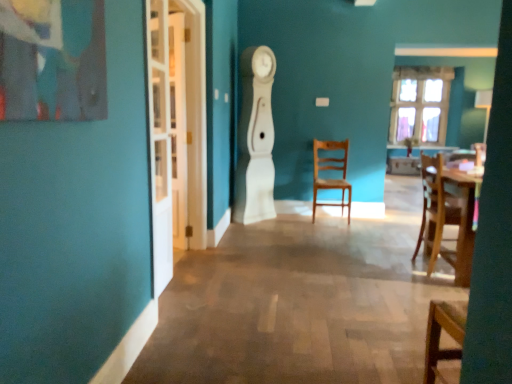
Question: From the image's perspective, relative to wooden table at right, is white glass door at left above or below?

Choices:
 (A) below
 (B) above

Answer: (B)

Question: From a real-world perspective, relative to wooden table at right, is white glass door at left vertically above or below?

Choices:
 (A) above
 (B) below

Answer: (A)

Question: Which object is the farthest from the white glossy clock at center?

Choices:
 (A) clear glass window at upper right
 (B) white glass door at left
 (C) wooden chair at center
 (D) white glass door at left
 (E) wooden table at right

Answer: (A)

Question: Considering the real-world distances, which object is closest to the white glossy clock at center?

Choices:
 (A) white glass door at left
 (B) wooden chair at center
 (C) clear glass window at upper right
 (D) wooden table at right
 (E) white glass door at left

Answer: (B)